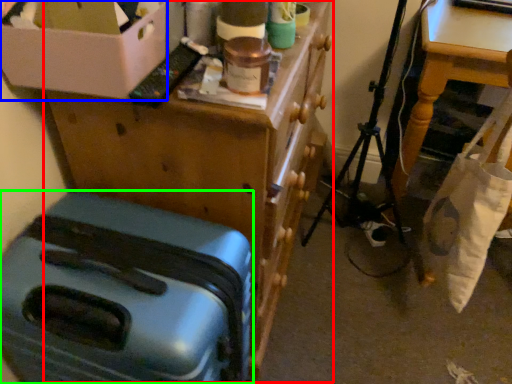
Question: Estimate the real-world distances between objects in this image. Which object is farther from furniture (highlighted by a red box), box (highlighted by a blue box) or suitcase (highlighted by a green box)?

Choices:
 (A) box
 (B) suitcase

Answer: (A)